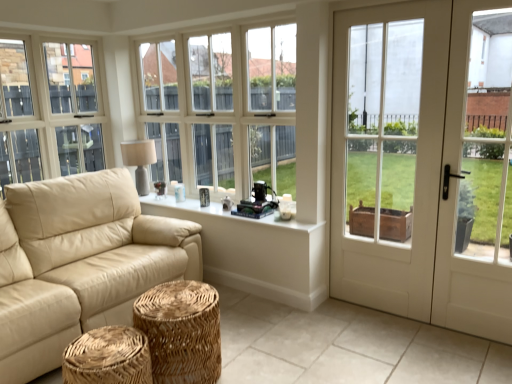
This screenshot has width=512, height=384. I want to click on vacant space in between woven natural stool at center, placed as the second stool when sorted from front to back, and white glass door at right, so tap(349, 353).